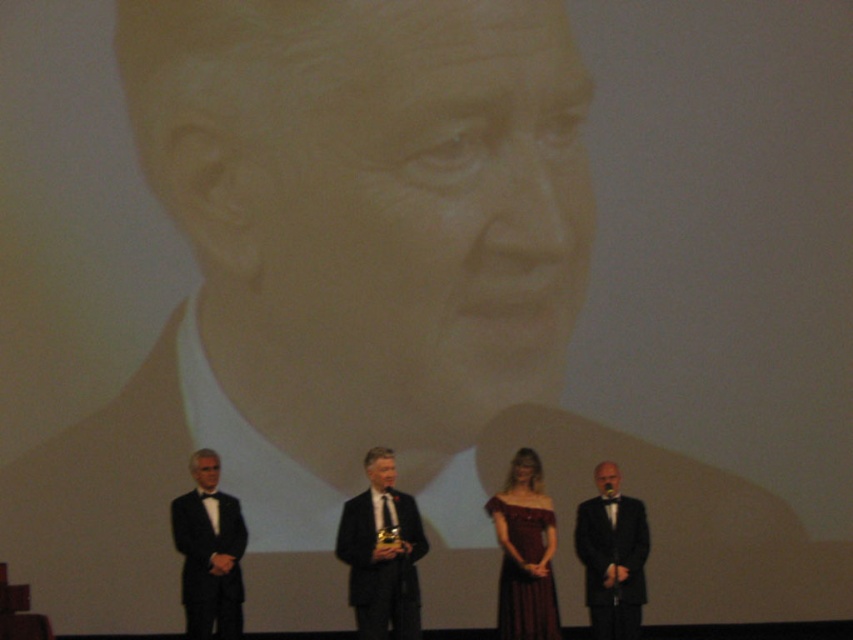
Question: Can you confirm if black satin suit at left is positioned below velvet burgundy dress at center?

Choices:
 (A) no
 (B) yes

Answer: (B)

Question: Is black satin suit at left smaller than black satin suit at lower right?

Choices:
 (A) yes
 (B) no

Answer: (B)

Question: Which point is closer to the camera?

Choices:
 (A) velvet burgundy dress at center
 (B) black satin suit at left
 (C) black satin suit at lower right

Answer: (A)

Question: Among these points, which one is nearest to the camera?

Choices:
 (A) (509, 548)
 (B) (421, 520)
 (C) (236, 524)

Answer: (A)

Question: Among these objects, which one is nearest to the camera?

Choices:
 (A) matte black suit at center
 (B) black satin suit at left
 (C) velvet burgundy dress at center

Answer: (A)

Question: In this image, where is matte black suit at center located relative to velvet burgundy dress at center?

Choices:
 (A) above
 (B) below

Answer: (B)